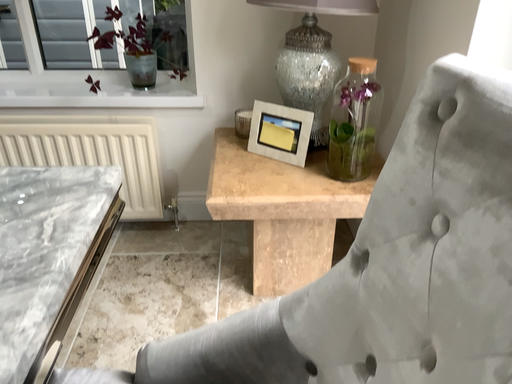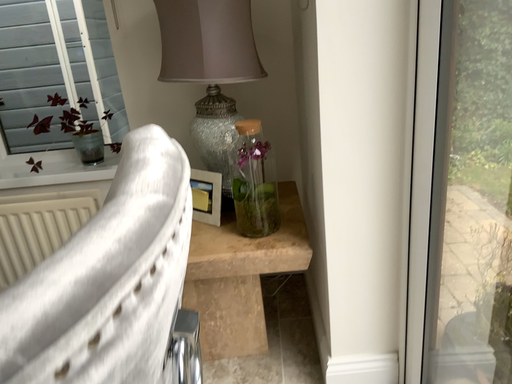
Question: How did the camera likely rotate when shooting the video?

Choices:
 (A) rotated downward
 (B) rotated upward

Answer: (B)